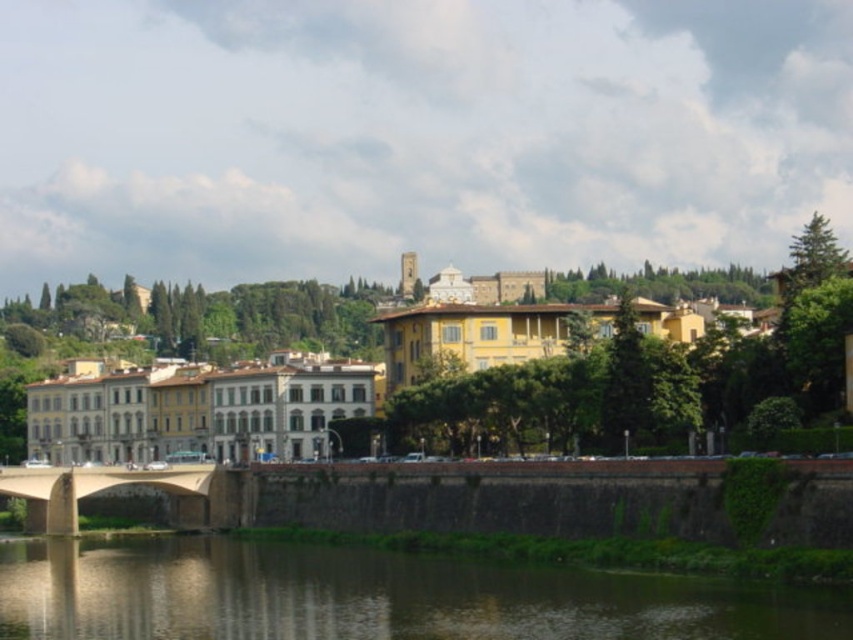
Question: Does yellow matte building at center have a smaller size compared to brown stone bridge at lower left?

Choices:
 (A) yes
 (B) no

Answer: (B)

Question: Estimate the real-world distances between objects in this image. Which object is closer to the brown reflective water at lower center?

Choices:
 (A) yellow matte building at center
 (B) brown stone bridge at lower left

Answer: (B)

Question: Which point is farther to the camera?

Choices:
 (A) (631, 433)
 (B) (53, 474)
 (C) (331, 564)

Answer: (B)

Question: Can you confirm if yellow matte building at center is bigger than brown stone bridge at lower left?

Choices:
 (A) no
 (B) yes

Answer: (B)

Question: Is brown reflective water at lower center wider than brown stone bridge at lower left?

Choices:
 (A) yes
 (B) no

Answer: (A)

Question: Which point is farther to the camera?

Choices:
 (A) (184, 477)
 (B) (483, 349)
 (C) (97, 580)

Answer: (B)